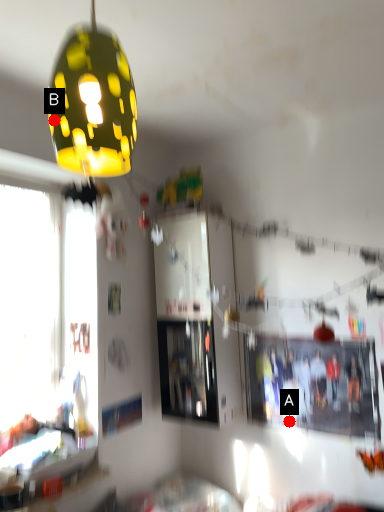
Question: Two points are circled on the image, labeled by A and B beside each circle. Which point appears farthest from the camera in this image?

Choices:
 (A) A is further
 (B) B is further

Answer: (A)